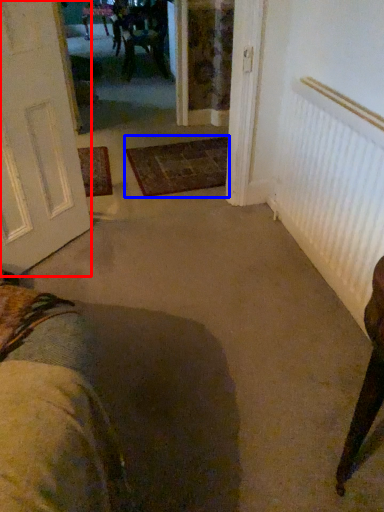
Question: Which object is further to the camera taking this photo, door (highlighted by a red box) or doormat (highlighted by a blue box)?

Choices:
 (A) door
 (B) doormat

Answer: (B)